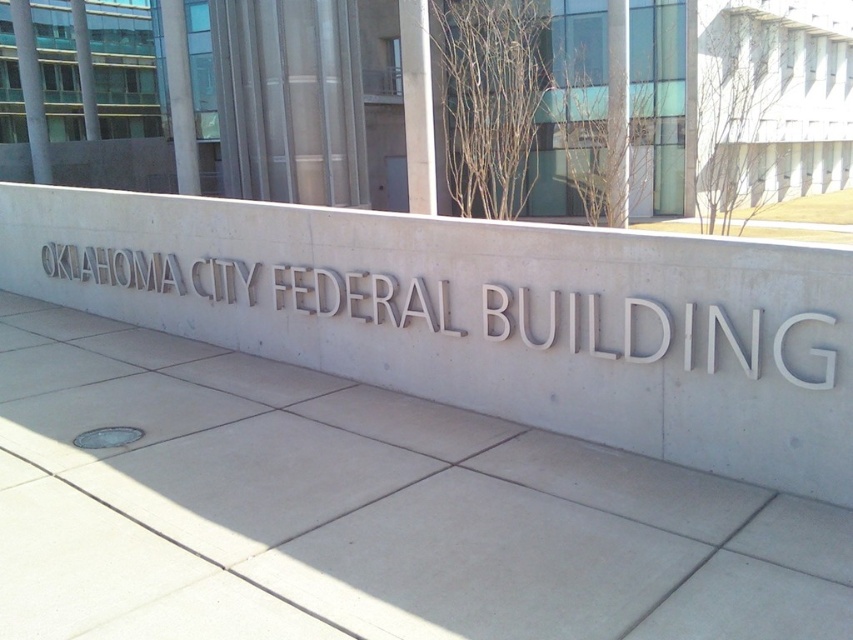
Question: Estimate the real-world distances between objects in this image. Which object is farther from the gray metallic sign at center?

Choices:
 (A) gray concrete pavement at center
 (B) gray concrete sign at center

Answer: (A)

Question: Where is gray concrete pavement at center located in relation to gray metallic sign at center in the image?

Choices:
 (A) above
 (B) below

Answer: (B)

Question: Can you confirm if gray concrete pavement at center is wider than gray metallic sign at center?

Choices:
 (A) no
 (B) yes

Answer: (B)

Question: Is gray concrete pavement at center thinner than gray metallic sign at center?

Choices:
 (A) no
 (B) yes

Answer: (A)

Question: Which point is farther to the camera?

Choices:
 (A) (238, 321)
 (B) (219, 292)

Answer: (B)

Question: Which object is farther from the camera taking this photo?

Choices:
 (A) gray concrete pavement at center
 (B) gray metallic sign at center
 (C) gray concrete sign at center

Answer: (C)